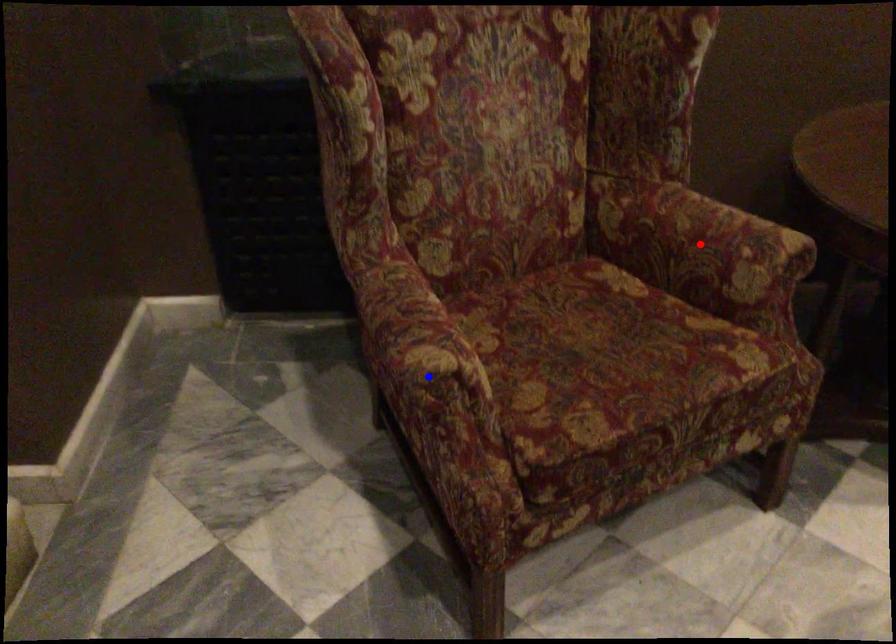
Question: In the image, two points are highlighted. Which point is nearer to the camera? Reply with the corresponding letter.

Choices:
 (A) blue point
 (B) red point

Answer: (A)